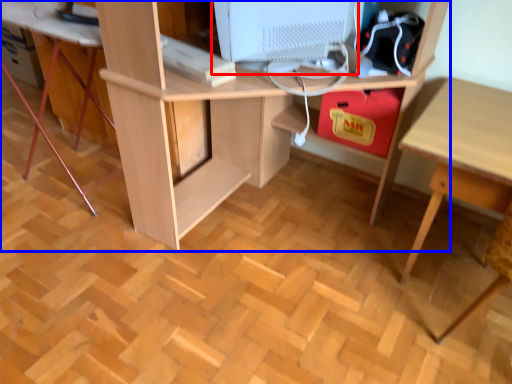
Question: Which of the following is the closest to the observer, computer monitor (highlighted by a red box) or desk (highlighted by a blue box)?

Choices:
 (A) computer monitor
 (B) desk

Answer: (B)